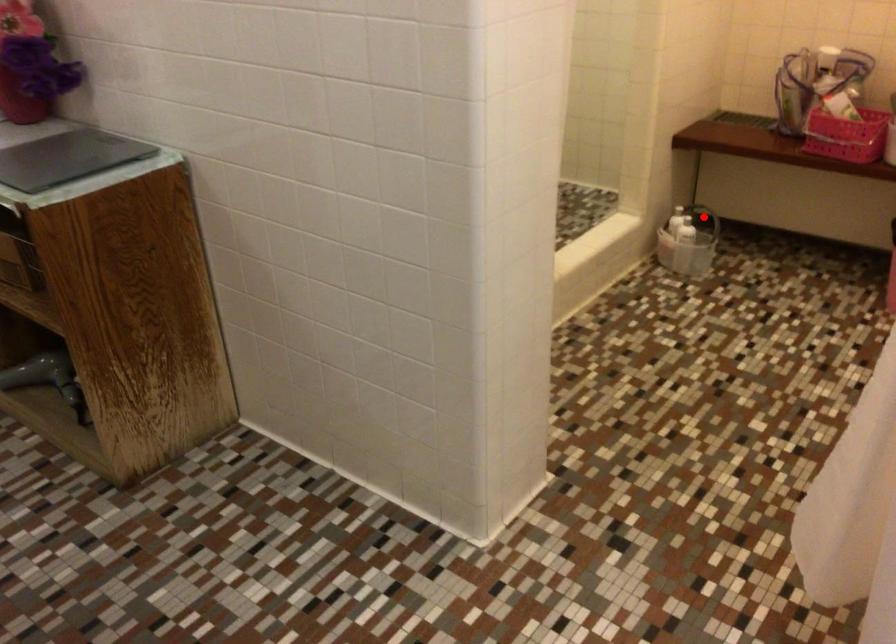
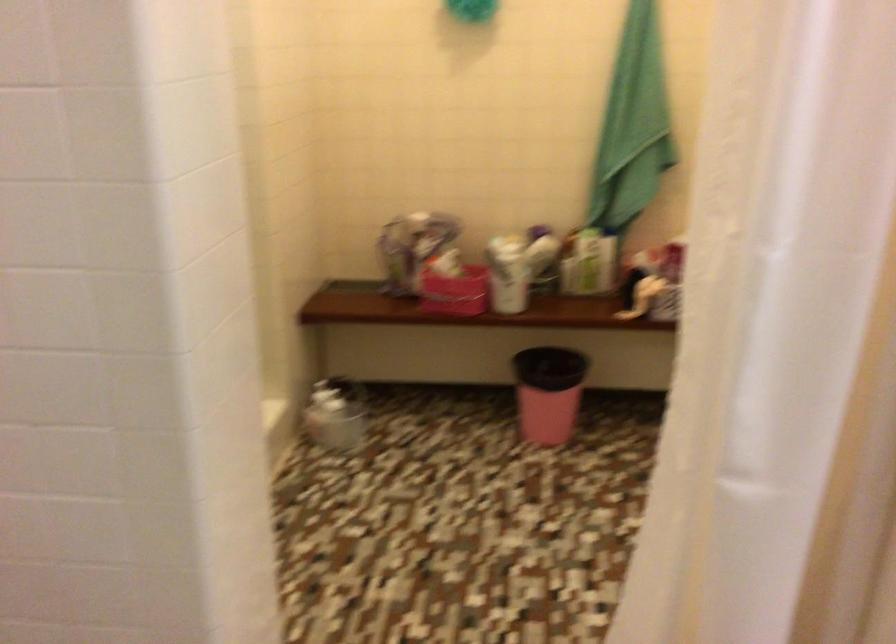
Question: I am providing you with two images of the same scene from different viewpoints. A red point is marked on the first image. Is the red point's position out of view in image 2?

Choices:
 (A) Yes
 (B) No

Answer: (A)